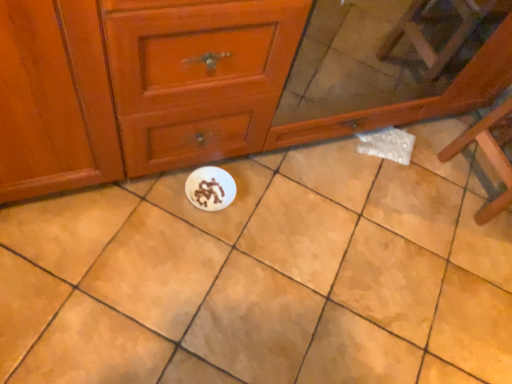
You are a GUI agent. You are given a task and a screenshot of the screen. Output one action in this format:
    pyautogui.click(x=<x>, y=<y>)
    Task: Click on the vacant area that lies between wooden chair at right and matte wood chest of drawers at center
    This screenshot has height=384, width=512.
    Given the screenshot: What is the action you would take?
    pyautogui.click(x=315, y=203)